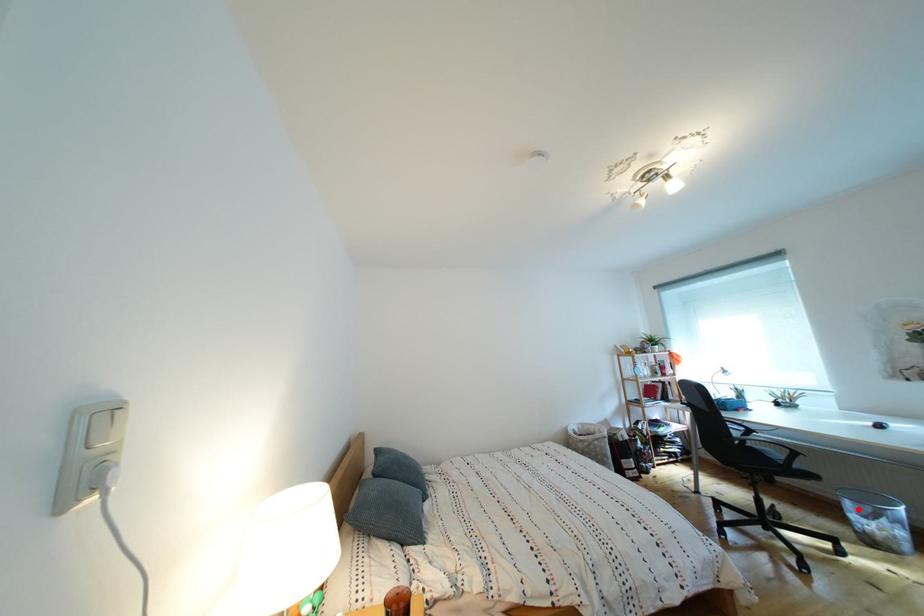
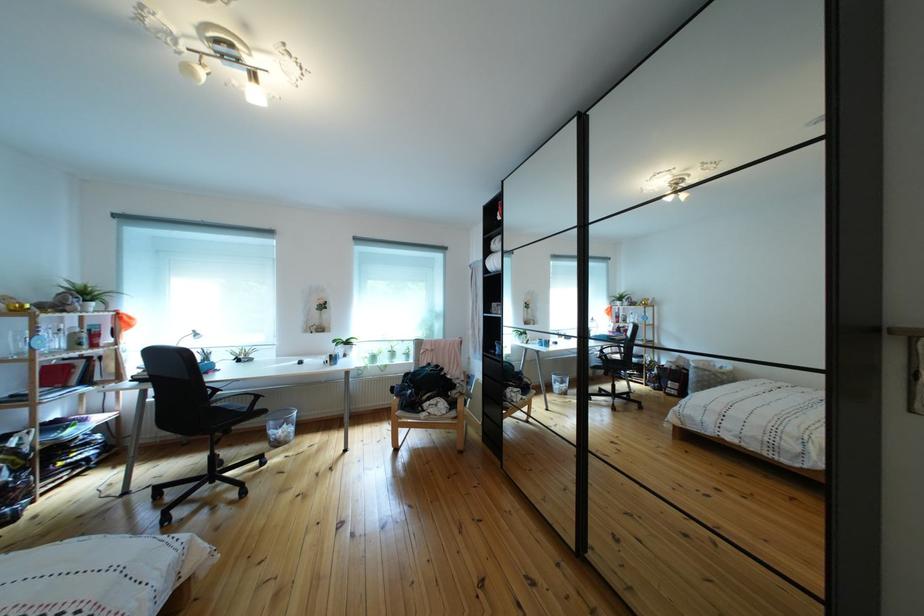
Question: A red point is marked in image1. In image2, is the corresponding 3D point closer to the camera or farther? Reply with the corresponding letter.

Choices:
 (A) The corresponding 3D point is closer.
 (B) The corresponding 3D point is farther.

Answer: (B)